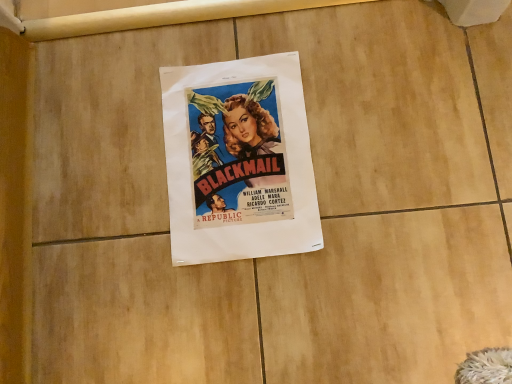
Locate an element on the screen. blank space situated above matte paper poster at center (from a real-world perspective) is located at coordinates (236, 149).